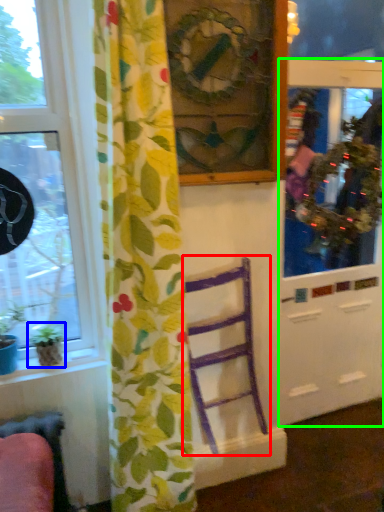
Question: Which is farther away from furniture (highlighted by a red box)? houseplant (highlighted by a blue box) or screen door (highlighted by a green box)?

Choices:
 (A) houseplant
 (B) screen door

Answer: (A)